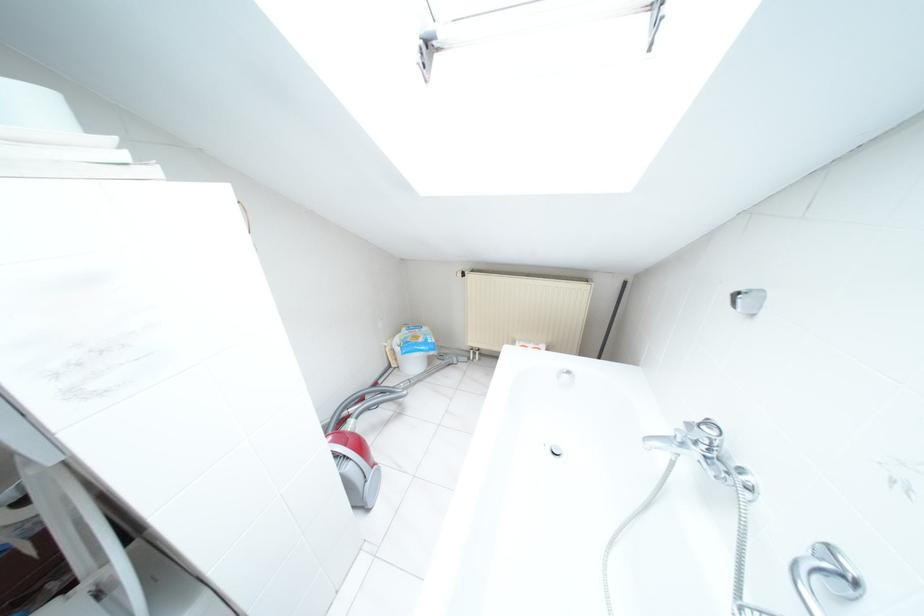
What do you see at coordinates (468, 273) in the screenshot? Image resolution: width=924 pixels, height=616 pixels. I see `the radiator valve` at bounding box center [468, 273].